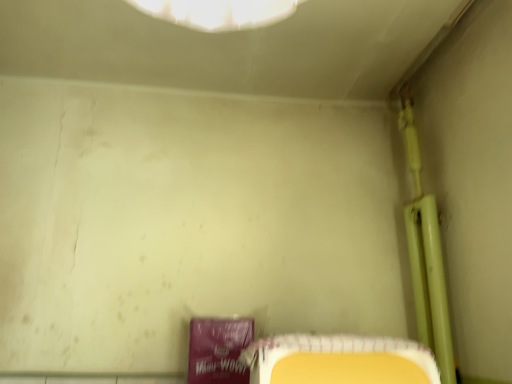
Question: From the image's perspective, relative to yellow plastic tray at lower right, is green matte pipe at upper right above or below?

Choices:
 (A) below
 (B) above

Answer: (B)

Question: Does point (415, 233) appear closer or farther from the camera than point (413, 375)?

Choices:
 (A) closer
 (B) farther

Answer: (B)

Question: Visually, is green matte pipe at upper right positioned to the left or to the right of yellow plastic tray at lower right?

Choices:
 (A) left
 (B) right

Answer: (B)

Question: Is yellow plastic tray at lower right wider or thinner than green matte pipe at upper right?

Choices:
 (A) thin
 (B) wide

Answer: (B)

Question: Considering the relative positions of yellow plastic tray at lower right and green matte pipe at upper right in the image provided, is yellow plastic tray at lower right to the left or to the right of green matte pipe at upper right?

Choices:
 (A) right
 (B) left

Answer: (B)

Question: From the image's perspective, is yellow plastic tray at lower right positioned above or below green matte pipe at upper right?

Choices:
 (A) above
 (B) below

Answer: (B)

Question: Is yellow plastic tray at lower right bigger or smaller than green matte pipe at upper right?

Choices:
 (A) small
 (B) big

Answer: (A)